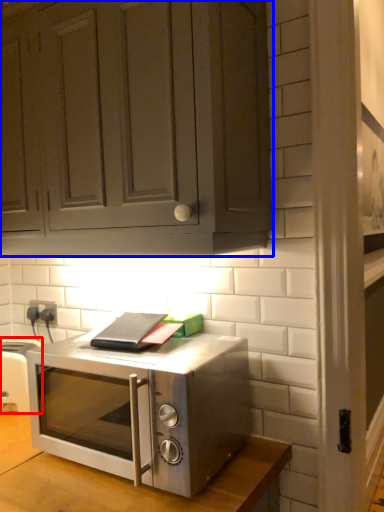
Question: Which point is closer to the camera, appliance (highlighted by a red box) or cabinetry (highlighted by a blue box)?

Choices:
 (A) appliance
 (B) cabinetry

Answer: (B)